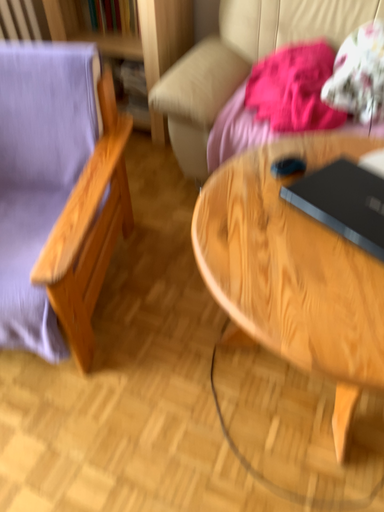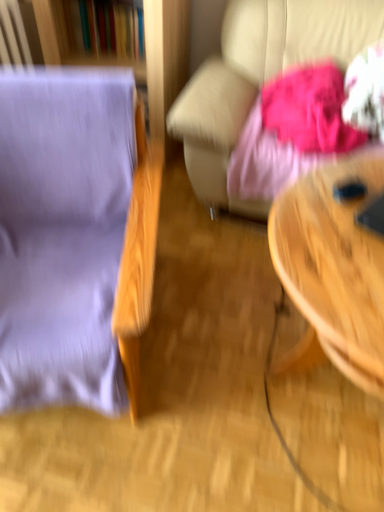
Question: Which way did the camera rotate in the video?

Choices:
 (A) rotated left
 (B) rotated right

Answer: (B)